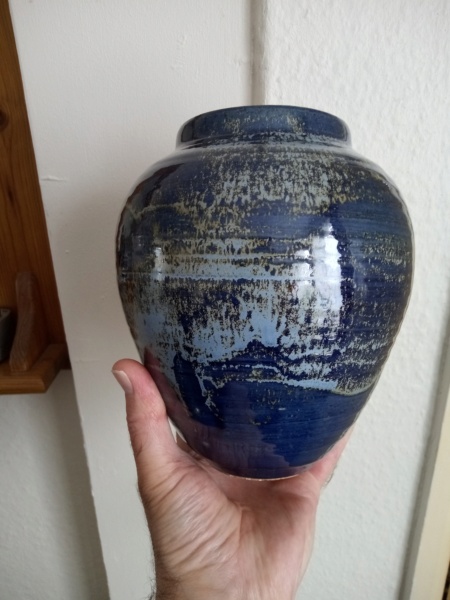
I want to click on gray on vase, so click(335, 289).